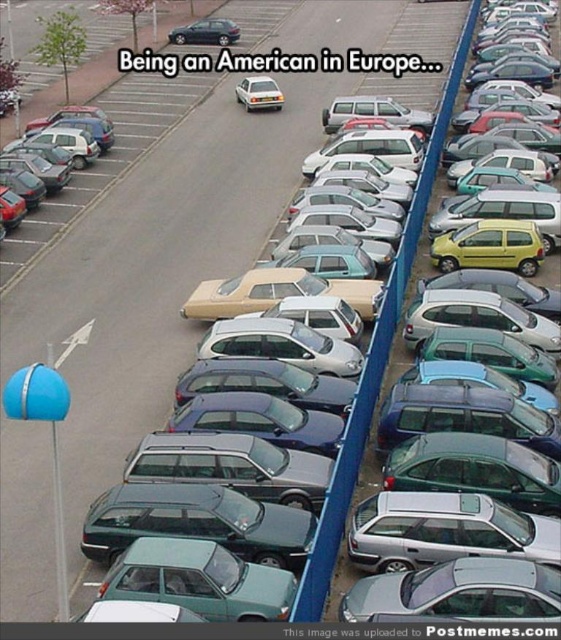
Question: Which point is closer to the camera?

Choices:
 (A) (52, 120)
 (B) (462, 22)
 (C) (247, 104)

Answer: (A)

Question: Is matte beige car at left positioned in front of shiny metallic sedan at center?

Choices:
 (A) yes
 (B) no

Answer: (A)

Question: Does matte silver hatchback at center-right appear under silver metallic hatchback at center?

Choices:
 (A) no
 (B) yes

Answer: (B)

Question: Can you confirm if matte beige car at left is smaller than shiny metallic sedan at center?

Choices:
 (A) no
 (B) yes

Answer: (A)

Question: Which point is closer to the camera?

Choices:
 (A) matte beige car at left
 (B) matte silver hatchback at center-right
 (C) shiny metallic sedan at center

Answer: (B)

Question: Which is nearer to the matte beige car at left?

Choices:
 (A) matte silver hatchback at center-right
 (B) shiny metallic sedan at center

Answer: (A)